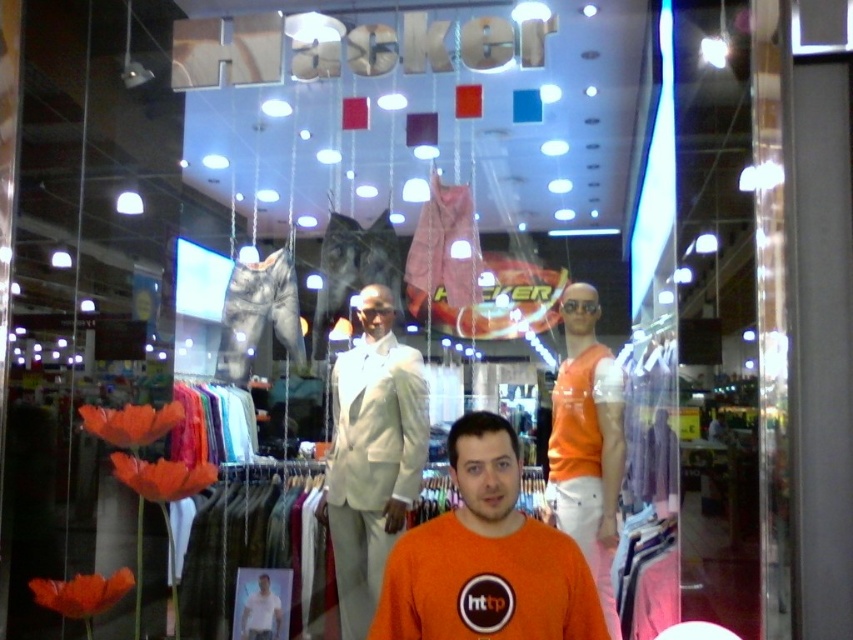
Question: Is orange cotton t-shirt at center to the left of orange fabric mannequin at right from the viewer's perspective?

Choices:
 (A) yes
 (B) no

Answer: (A)

Question: Which object is farther from the camera taking this photo?

Choices:
 (A) white satin suit at center
 (B) orange cotton t-shirt at center

Answer: (A)

Question: Which point is farther from the camera taking this photo?

Choices:
 (A) click(415, 355)
 (B) click(457, 468)
 (C) click(567, 435)

Answer: (A)

Question: Which object is farther from the camera taking this photo?

Choices:
 (A) white satin suit at center
 (B) orange cotton t-shirt at center

Answer: (A)

Question: Is orange cotton t-shirt at center smaller than orange fabric mannequin at right?

Choices:
 (A) no
 (B) yes

Answer: (B)

Question: Is orange cotton t-shirt at center below white satin suit at center?

Choices:
 (A) no
 (B) yes

Answer: (A)